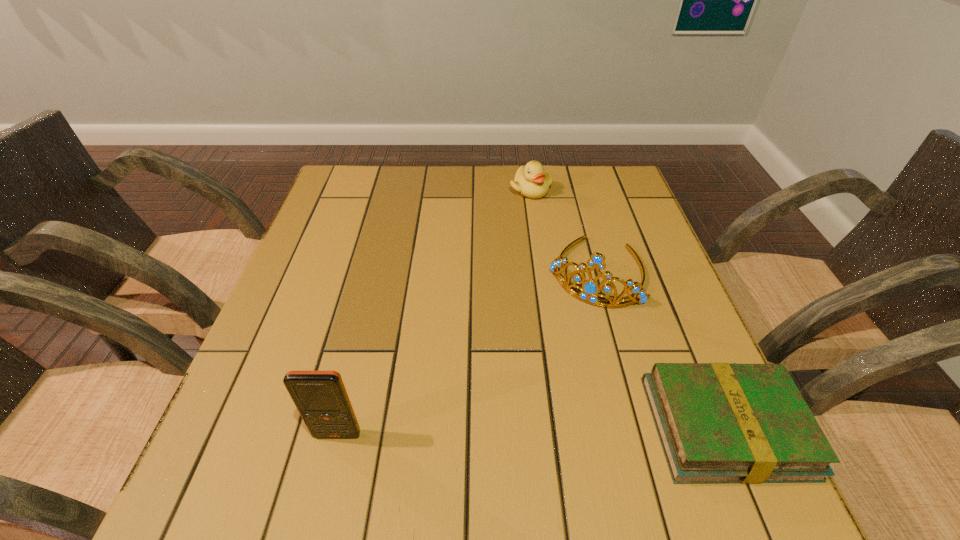
You are a GUI agent. You are given a task and a screenshot of the screen. Output one action in this format:
    pyautogui.click(x=<x>, y=<y>)
    Task: Click on the free space on the desktop that is between the tallest object and the shortest object and is positioned on the front-facing side of the second tallest object
    The width and height of the screenshot is (960, 540).
    Given the screenshot: What is the action you would take?
    pyautogui.click(x=512, y=431)

This screenshot has height=540, width=960. I want to click on vacant space on the desktop that is between the tallest object and the book and is positioned on the front-facing side of the farthest object, so click(x=498, y=431).